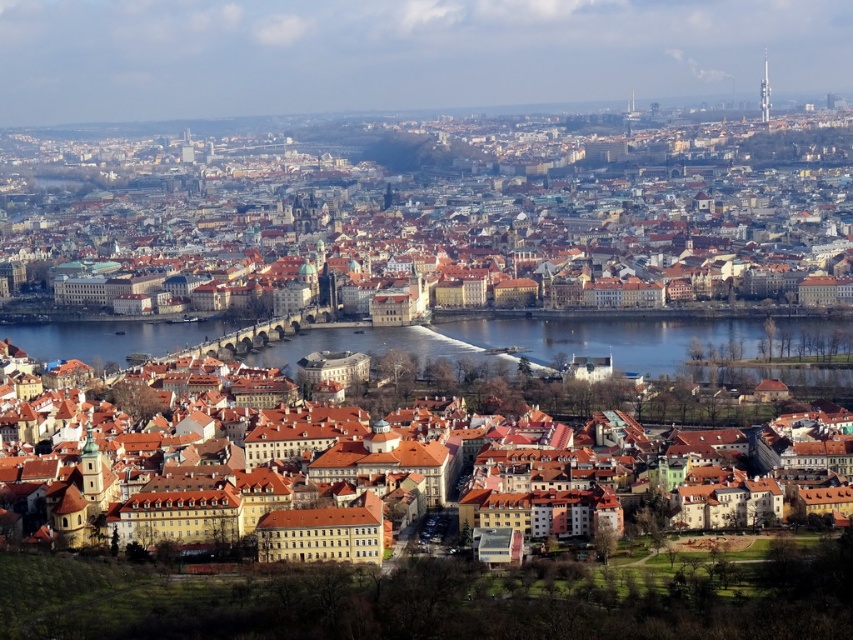
You are a tourist standing at the Charles Bridge and looking at the brown tiled roofs at center and the blue water at center. Which one is above the other?

The brown tiled roofs at center are positioned over the blue water at center, so the brown tiled roofs at center are above the blue water at center.

You are an architect analyzing the city layout. You observe the brown tiled roofs at center and the brown textured buildings at center. Which of these two features is located higher in elevation?

The brown tiled roofs at center are positioned over the brown textured buildings at center, meaning they are higher in elevation.

You are a drone operator tasked with capturing aerial footage of the historic cityscape. Your drone has a maximum flight range of 100 meters. From your current position, you need to fly to the brown textured buildings at center to capture their architecture. However, you also want to include the brown tiled roofs at center in the same shot. Can your drone stay within its range limit while capturing both objects?

The brown tiled roofs at center is 110.53 meters from brown textured buildings at center. Since the distance exceeds the drone s 100 meter range limit, the drone cannot capture both objects in the same shot while staying within its range.